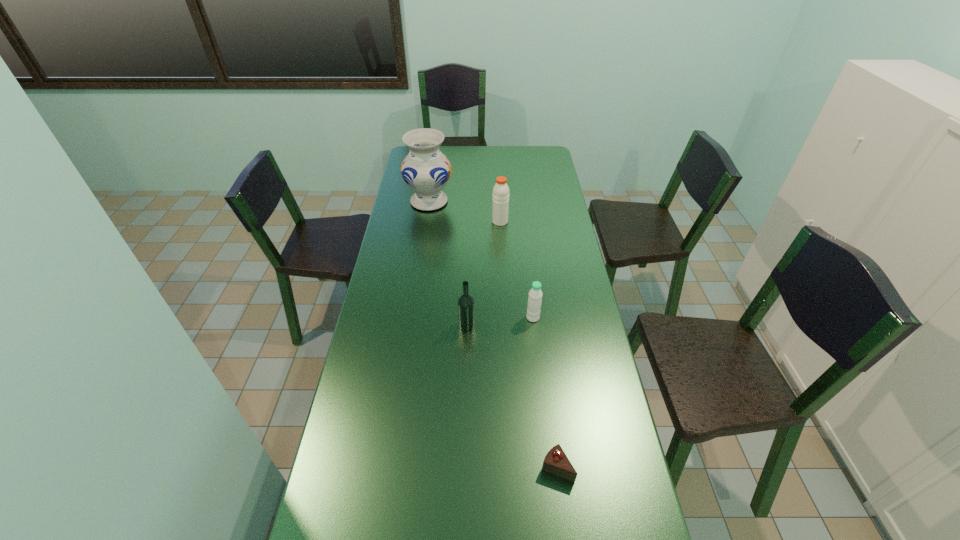
You are a GUI agent. You are given a task and a screenshot of the screen. Output one action in this format:
    pyautogui.click(x=<x>, y=<y>)
    Task: Click on the vacant space that is in between the second shortest object and the vodka
    
    Given the screenshot: What is the action you would take?
    pyautogui.click(x=500, y=321)

Locate an element on the screen. The height and width of the screenshot is (540, 960). vacant area that lies between the fourth tallest object and the farthest object is located at coordinates (481, 260).

The height and width of the screenshot is (540, 960). I want to click on free area in between the chocolate cake and the third object from left to right, so click(x=529, y=345).

Find the location of a particular element. Image resolution: width=960 pixels, height=540 pixels. empty location between the fourth tallest object and the nearest object is located at coordinates (545, 393).

The height and width of the screenshot is (540, 960). I want to click on vacant area that lies between the tallest object and the water bottle, so click(481, 260).

Image resolution: width=960 pixels, height=540 pixels. What are the coordinates of `free spot between the shaker and the vodka` in the screenshot? It's located at (484, 273).

Image resolution: width=960 pixels, height=540 pixels. Find the location of `vacant area that lies between the vodka and the shaker`. vacant area that lies between the vodka and the shaker is located at coordinates 484,273.

Where is `vacant space that's between the shortest object and the fourth tallest object`? vacant space that's between the shortest object and the fourth tallest object is located at coordinates (545, 393).

You are a GUI agent. You are given a task and a screenshot of the screen. Output one action in this format:
    pyautogui.click(x=<x>, y=<y>)
    Task: Click on the free space that is in between the vase and the shaker
    The width and height of the screenshot is (960, 540).
    Given the screenshot: What is the action you would take?
    pyautogui.click(x=465, y=212)

This screenshot has height=540, width=960. I want to click on object that is the fourth closest one to the leftmost object, so [x=556, y=462].